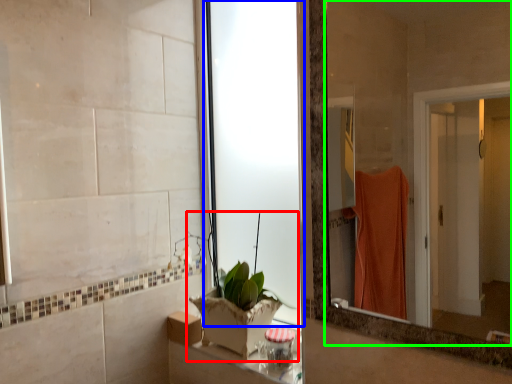
Question: Based on their relative distances, which object is nearer to houseplant (highlighted by a red box)? Choose from glass door (highlighted by a blue box) and mirror (highlighted by a green box).

Choices:
 (A) glass door
 (B) mirror

Answer: (A)